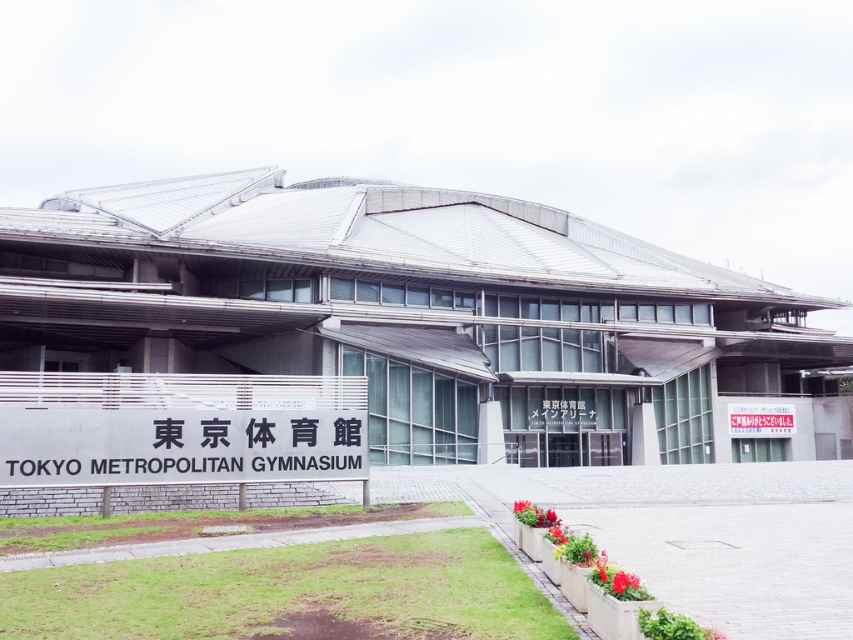
Between black sign at center and white paper sign at center, which one is positioned lower?

white paper sign at center is lower down.

Identify the location of black sign at center. (178, 445).